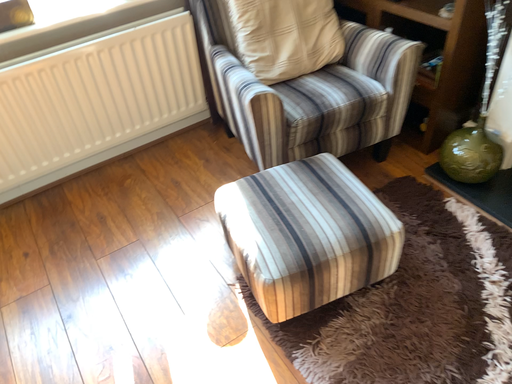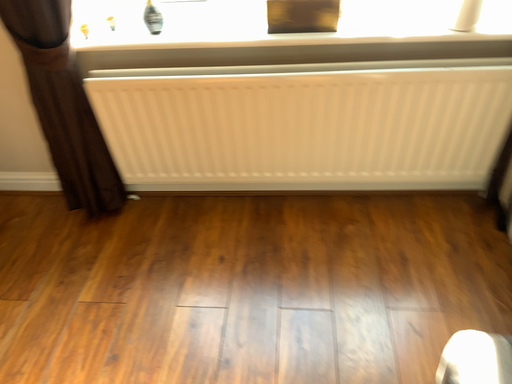
Question: Which way did the camera rotate in the video?

Choices:
 (A) rotated left
 (B) rotated right

Answer: (A)